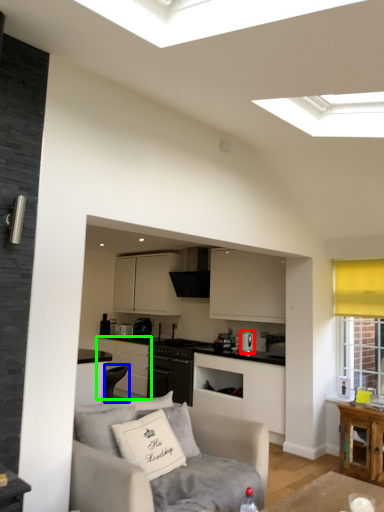
Question: Which is nearer to the appliance (highlighted by a red box)? armchair (highlighted by a blue box) or cabinetry (highlighted by a green box).

Choices:
 (A) armchair
 (B) cabinetry

Answer: (B)